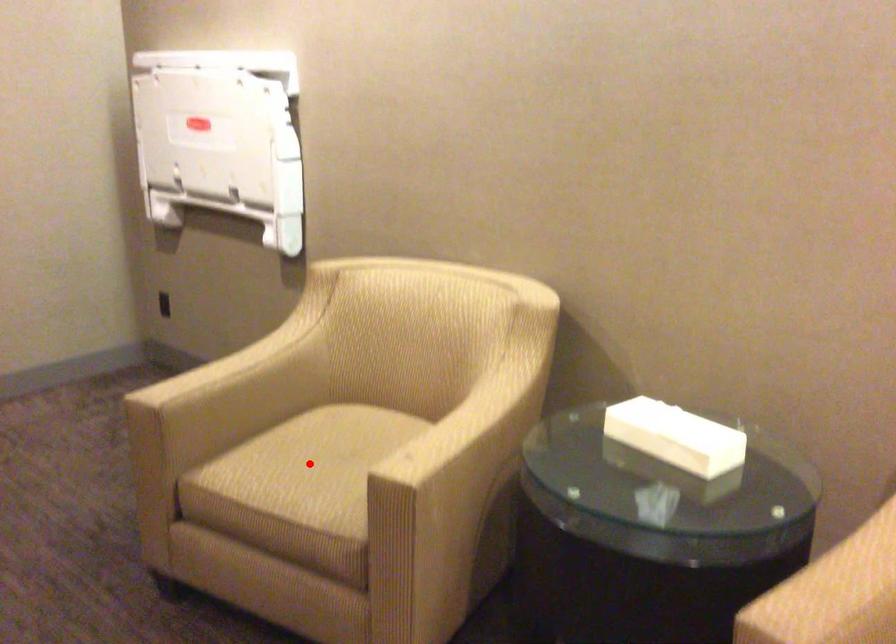
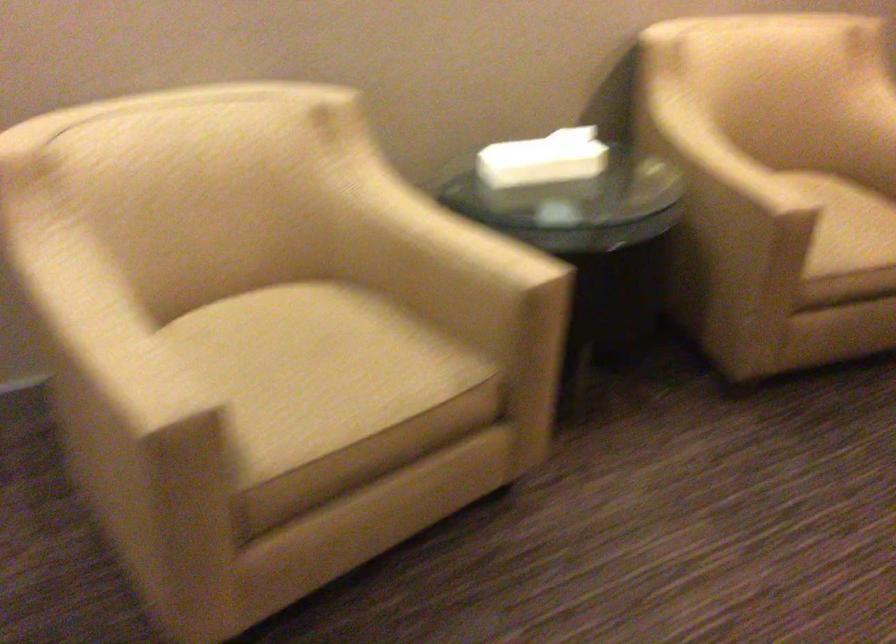
Locate, in the second image, the point that corresponds to the highlighted location in the first image.

(316, 370)